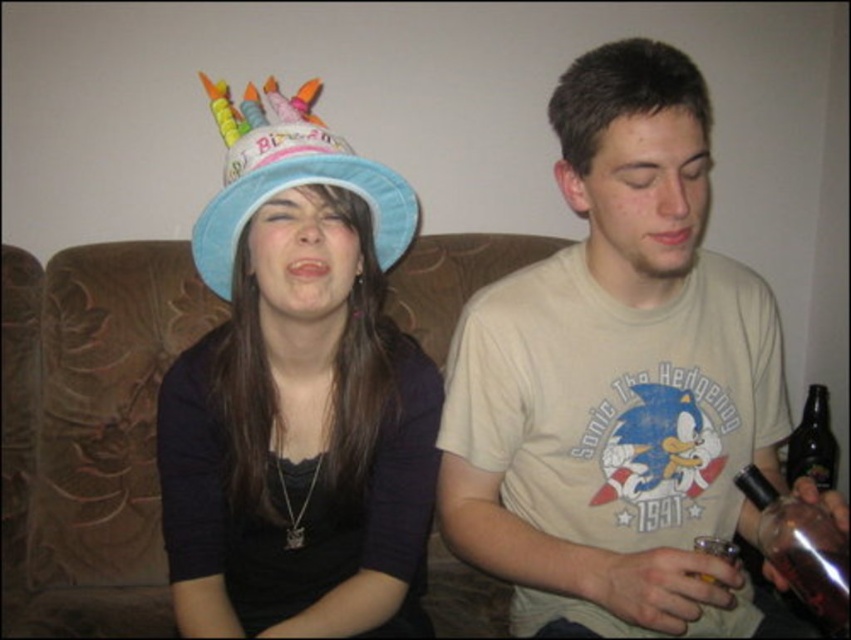
Who is shorter, brown fabric couch at center or blue paper hat at upper left?

blue paper hat at upper left is shorter.

Is brown fabric couch at center above blue paper hat at upper left?

Incorrect, brown fabric couch at center is not positioned above blue paper hat at upper left.

Is point (146, 612) positioned after point (393, 204)?

Yes.

The width and height of the screenshot is (851, 640). Find the location of `brown fabric couch at center`. brown fabric couch at center is located at coordinates (90, 433).

Which is above, beige cotton t-shirt at center or blue paper hat at upper left?

blue paper hat at upper left

Between beige cotton t-shirt at center and blue paper hat at upper left, which one is positioned lower?

Positioned lower is beige cotton t-shirt at center.

This screenshot has height=640, width=851. I want to click on beige cotton t-shirt at center, so click(618, 380).

Does beige cotton t-shirt at center appear on the right side of matte blue hat at center?

Yes, beige cotton t-shirt at center is to the right of matte blue hat at center.

Between beige cotton t-shirt at center and matte blue hat at center, which one has more height?

beige cotton t-shirt at center

Which is in front, point (712, 492) or point (175, 595)?

Point (175, 595)

The width and height of the screenshot is (851, 640). In order to click on beige cotton t-shirt at center in this screenshot , I will do `click(618, 380)`.